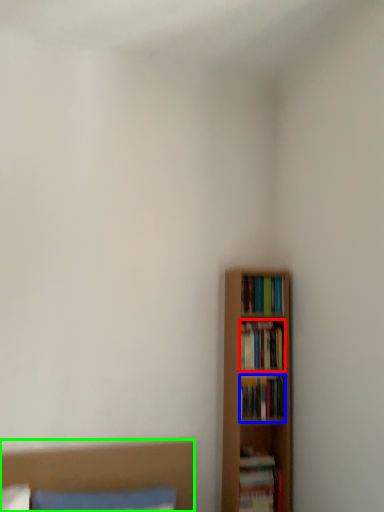
Question: Considering the real-world distances, which object is farthest from book (highlighted by a red box)? book (highlighted by a blue box) or bed (highlighted by a green box)?

Choices:
 (A) book
 (B) bed

Answer: (B)